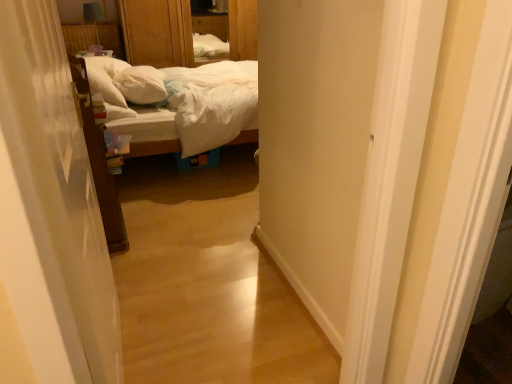
Question: From a real-world perspective, relative to wooden dresser at upper center, is white soft bed at center vertically above or below?

Choices:
 (A) above
 (B) below

Answer: (B)

Question: Which is correct: white soft bed at center is inside wooden dresser at upper center, or outside of it?

Choices:
 (A) inside
 (B) outside

Answer: (B)

Question: Which of these objects is positioned closest to the white soft pillow at center?

Choices:
 (A) white soft bed at center
 (B) wooden dresser at upper center
 (C) white sheer curtain at left

Answer: (A)

Question: Which object is positioned farthest from the white soft pillow at center?

Choices:
 (A) wooden dresser at upper center
 (B) white soft bed at center
 (C) white sheer curtain at left

Answer: (C)